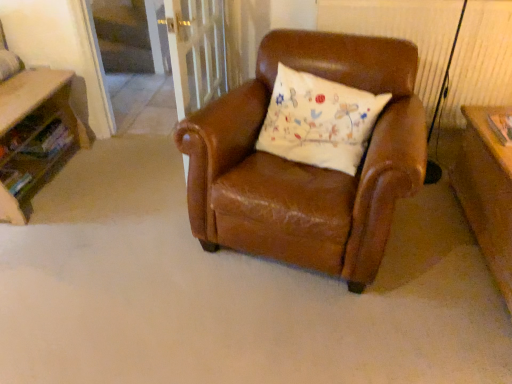
Where is `unoccupied region to the right of wooden table at left`? This screenshot has width=512, height=384. unoccupied region to the right of wooden table at left is located at coordinates (116, 192).